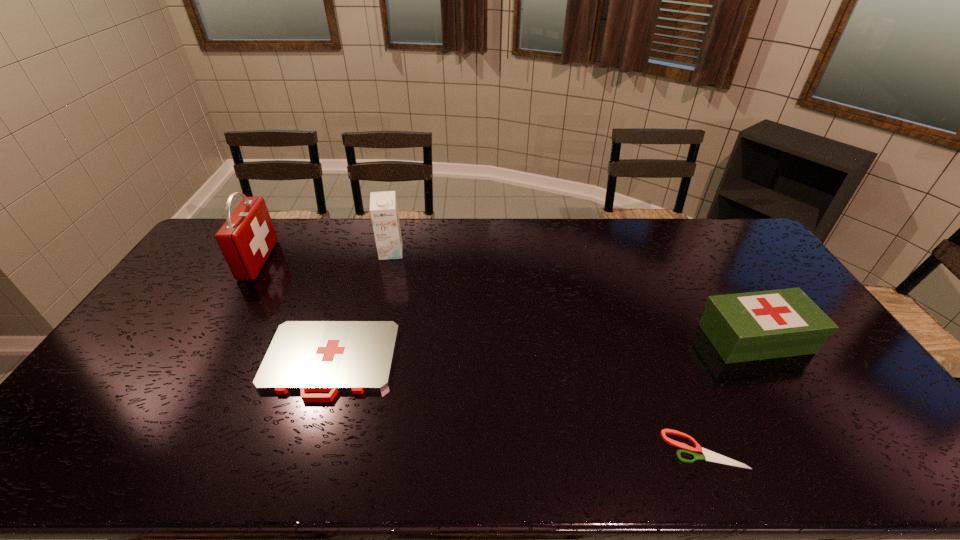
At what (x,y) coordinates should I click in order to perform the action: click on vacant space at the left edge of the desktop. Please return your answer as a coordinate pair (x, y). Looking at the image, I should click on (63, 430).

You are a GUI agent. You are given a task and a screenshot of the screen. Output one action in this format:
    pyautogui.click(x=<x>, y=<y>)
    Task: Click on the free space at the far right corner
    The width and height of the screenshot is (960, 540).
    Given the screenshot: What is the action you would take?
    pyautogui.click(x=760, y=255)

The height and width of the screenshot is (540, 960). In order to click on unoccupied position between the third tallest object and the second tallest object in this screenshot , I will do `click(573, 295)`.

You are a GUI agent. You are given a task and a screenshot of the screen. Output one action in this format:
    pyautogui.click(x=<x>, y=<y>)
    Task: Click on the vacant space that's between the rightmost first-aid kit and the shortest first-aid kit
    The height and width of the screenshot is (540, 960).
    Given the screenshot: What is the action you would take?
    pyautogui.click(x=542, y=350)

The image size is (960, 540). I want to click on free space between the leftmost object and the second object from right to left, so click(481, 355).

This screenshot has width=960, height=540. Identify the location of vacant space in between the third tallest object and the leftmost first-aid kit. (507, 299).

The image size is (960, 540). Find the location of `free space that is in between the second tallest first-aid kit and the fourth tallest object`. free space that is in between the second tallest first-aid kit and the fourth tallest object is located at coordinates (542, 350).

Where is `vacant region between the second first-aid kit from left to right and the nearest object`? The image size is (960, 540). vacant region between the second first-aid kit from left to right and the nearest object is located at coordinates (517, 405).

Find the location of a particular element. The width and height of the screenshot is (960, 540). free spot between the shortest object and the fourth shortest object is located at coordinates (547, 351).

I want to click on vacant space that is in between the rightmost first-aid kit and the leftmost first-aid kit, so click(507, 299).